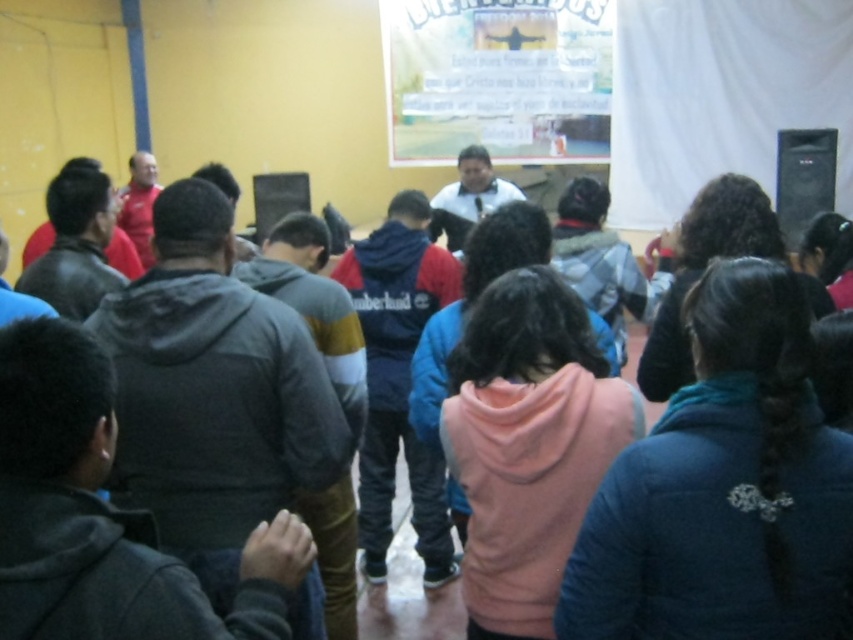
Question: Which point appears closest to the camera in this image?

Choices:
 (A) (572, 540)
 (B) (814, 138)
 (C) (780, 390)

Answer: (C)

Question: Is red fleece hoodie at center further to the viewer compared to dark gray hoodie at center?

Choices:
 (A) yes
 (B) no

Answer: (B)

Question: Which of these objects is positioned closest to the black matte speaker at upper right?

Choices:
 (A) red fleece hoodie at center
 (B) pink fleece jacket at center
 (C) dark gray hoodie at center

Answer: (A)

Question: Is red fleece hoodie at center to the right of dark gray hoodie at center from the viewer's perspective?

Choices:
 (A) yes
 (B) no

Answer: (A)

Question: Which object is farther from the camera taking this photo?

Choices:
 (A) dark gray hoodie at center
 (B) pink fleece jacket at center
 (C) red fleece hoodie at center

Answer: (A)

Question: In this image, where is blue fleece jacket at center located relative to black matte speaker at upper right?

Choices:
 (A) left
 (B) right

Answer: (A)